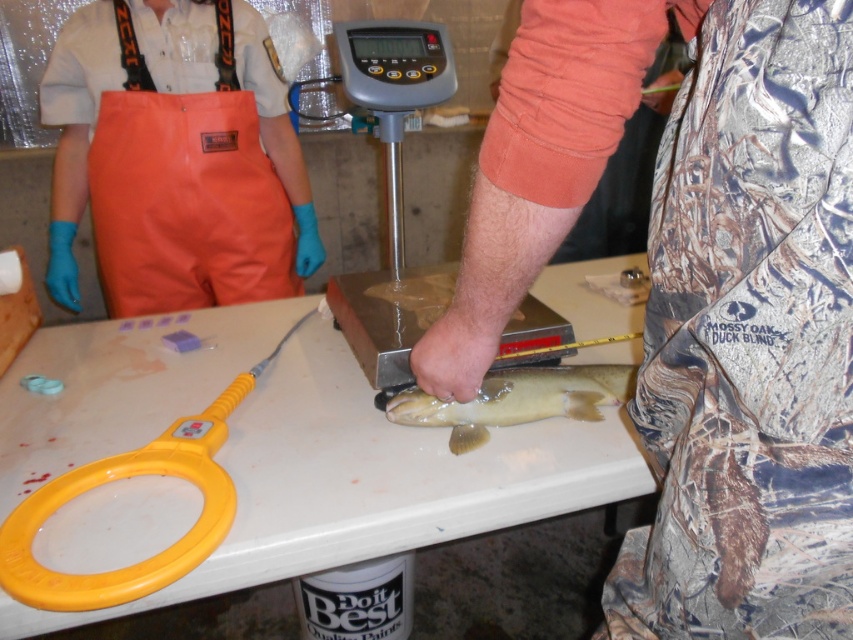
Question: Based on their relative distances, which object is nearer to the shiny brown fish at center?

Choices:
 (A) gray plastic scale at center
 (B) white plastic table at center
 (C) yellow plastic scissors at lower left
 (D) orange rubber pants at center

Answer: (A)

Question: Can you confirm if camouflage fabric pants at lower right is positioned above shiny brown fish at center?

Choices:
 (A) no
 (B) yes

Answer: (B)

Question: Based on their relative distances, which object is farther from the orange rubber pants at center?

Choices:
 (A) white plastic table at center
 (B) camouflage fabric pants at lower right
 (C) shiny brown fish at center

Answer: (B)

Question: Does camouflage fabric pants at lower right have a lesser width compared to orange rubber pants at center?

Choices:
 (A) yes
 (B) no

Answer: (A)

Question: Considering the real-world distances, which object is farthest from the gray plastic scale at center?

Choices:
 (A) white plastic table at center
 (B) orange rubber pants at center
 (C) yellow plastic scissors at lower left
 (D) shiny brown fish at center

Answer: (B)

Question: Is white plastic table at center to the right of gray plastic scale at center from the viewer's perspective?

Choices:
 (A) no
 (B) yes

Answer: (A)